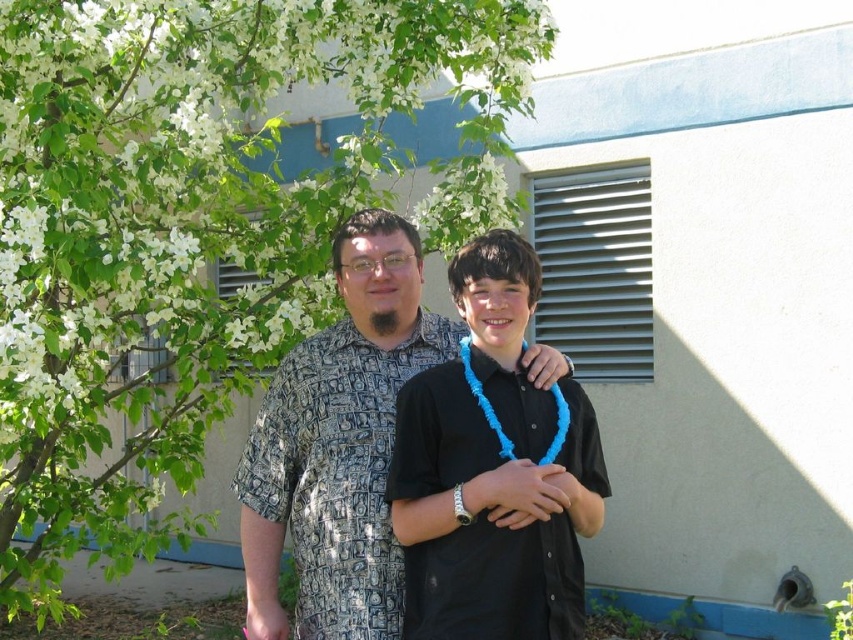
Question: Among these points, which one is farthest from the camera?

Choices:
 (A) (585, 452)
 (B) (289, 419)

Answer: (B)

Question: In this image, where is black matte shirt at center located relative to patterned fabric shirt at center?

Choices:
 (A) right
 (B) left

Answer: (A)

Question: Among these points, which one is farthest from the camera?

Choices:
 (A) (399, 605)
 (B) (576, 456)

Answer: (A)

Question: Does green leafy tree at upper left have a larger size compared to patterned fabric shirt at center?

Choices:
 (A) yes
 (B) no

Answer: (A)

Question: Which point appears closest to the camera in this image?

Choices:
 (A) (148, 404)
 (B) (351, 552)

Answer: (B)

Question: Can you confirm if black matte shirt at center is thinner than patterned fabric shirt at center?

Choices:
 (A) no
 (B) yes

Answer: (B)